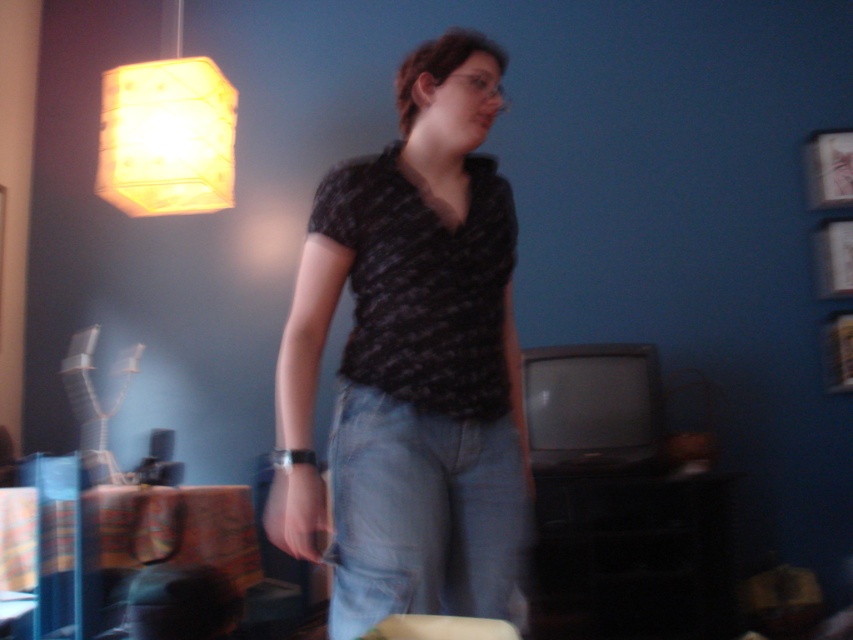
You are a photographer setting up a shoot in this room. You need to place a small tripod between the matte black shirt at center and the yellow paper lampshade at upper left. Based on their positions, where should you place the tripod so it stays between them?

The matte black shirt at center is positioned under the yellow paper lampshade at upper left, so placing the tripod between them would require positioning it below the yellow paper lampshade at upper left and above the matte black shirt at center to stay in between both objects.

You are a photographer setting up for a portrait. You have a camera with a focal length of 50mm and want to ensure the matte black shirt at center is in sharp focus. If you are standing 4.15 feet away from the subject, what adjustment might you need to make to the camera settings to achieve optimal focus?

The matte black shirt at center is 4.15 feet away from the camera. To achieve optimal focus with a 50mm lens at this distance, you should adjust the focus ring to match the 4.15 feet distance or use autofocus to lock onto the shirt.

You are an interior designer assessing the living space. You notice the matte black shirt at center and the yellow paper lampshade at upper left. Which object is taller in the scene?

The matte black shirt at center is taller than the yellow paper lampshade at upper left.